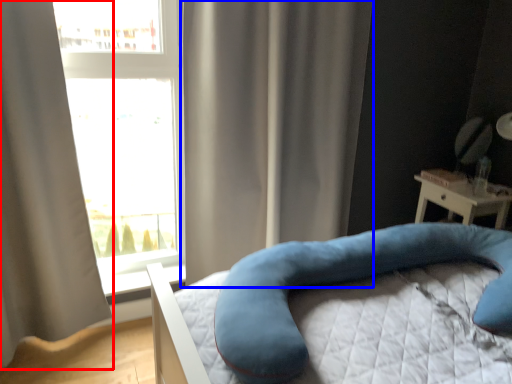
Question: Which point is closer to the camera, curtain (highlighted by a red box) or curtain (highlighted by a blue box)?

Choices:
 (A) curtain
 (B) curtain

Answer: (A)